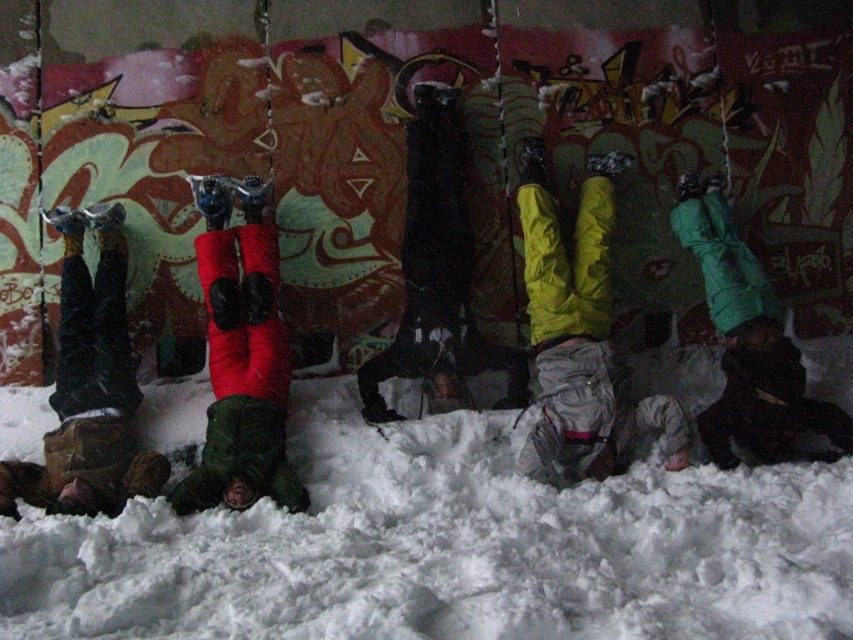
Which is more to the left, white fluffy snow at center or red fabric pants at left?

Positioned to the left is red fabric pants at left.

Locate an element on the screen. Image resolution: width=853 pixels, height=640 pixels. white fluffy snow at center is located at coordinates (447, 548).

Between white fluffy snow at center and green matte jacket at center, which one is positioned lower?

white fluffy snow at center is lower down.

Between white fluffy snow at center and green matte jacket at center, which one is positioned higher?

Positioned higher is green matte jacket at center.

The height and width of the screenshot is (640, 853). Describe the element at coordinates (447, 548) in the screenshot. I see `white fluffy snow at center` at that location.

Where is `white fluffy snow at center`? This screenshot has width=853, height=640. white fluffy snow at center is located at coordinates (447, 548).

Can you confirm if red fabric pants at left is wider than green matte jacket at center?

Yes, red fabric pants at left is wider than green matte jacket at center.

Between red fabric pants at left and green matte jacket at center, which one has less height?

Standing shorter between the two is red fabric pants at left.

Measure the distance between point (119, 240) and camera.

Point (119, 240) and camera are 6.25 meters apart from each other.

In order to click on red fabric pants at left in this screenshot , I will do `click(90, 387)`.